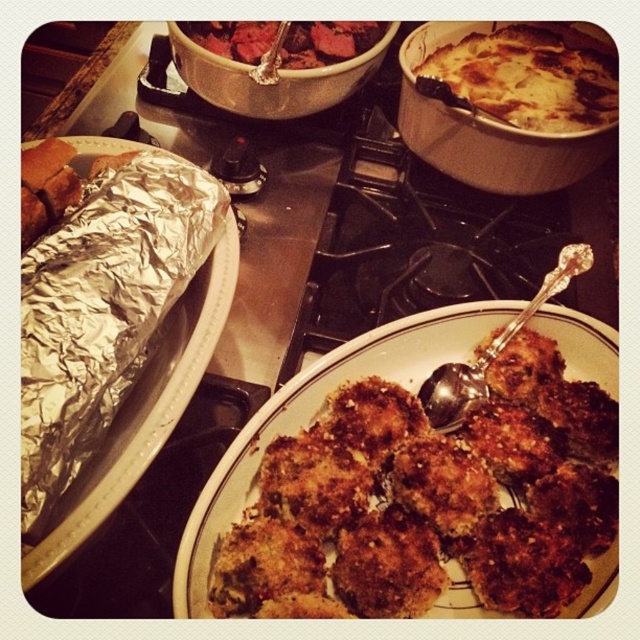
Which of these two, golden-brown cheesy casserole at upper right or silver metallic spoon at center-right, stands shorter?

silver metallic spoon at center-right is shorter.

Can you confirm if golden-brown cheesy casserole at upper right is positioned above silver metallic spoon at center-right?

Yes, golden-brown cheesy casserole at upper right is above silver metallic spoon at center-right.

This screenshot has height=640, width=640. I want to click on golden-brown cheesy casserole at upper right, so click(525, 77).

Does golden-brown crispy chicken nuggets at center have a greater width compared to dark red meat at center?

Yes.

Which is more to the right, golden-brown crispy chicken nuggets at center or dark red meat at center?

From the viewer's perspective, golden-brown crispy chicken nuggets at center appears more on the right side.

Identify the location of golden-brown crispy chicken nuggets at center. (426, 493).

Can you confirm if golden-brown crispy chicken nuggets at center is thinner than golden-brown cheesy casserole at upper right?

No, golden-brown crispy chicken nuggets at center is not thinner than golden-brown cheesy casserole at upper right.

Is point (538, 499) positioned before point (605, 80)?

Yes, point (538, 499) is closer to viewer.

Image resolution: width=640 pixels, height=640 pixels. What do you see at coordinates (426, 493) in the screenshot?
I see `golden-brown crispy chicken nuggets at center` at bounding box center [426, 493].

The width and height of the screenshot is (640, 640). I want to click on golden-brown crispy chicken nuggets at center, so click(x=426, y=493).